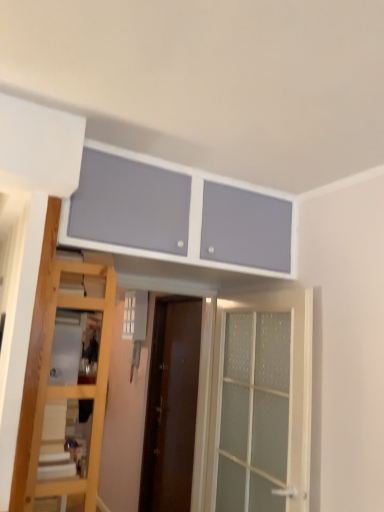
What do you see at coordinates (290, 386) in the screenshot?
I see `clear glass door at center, arranged as the first door when viewed from the front` at bounding box center [290, 386].

Where is `brown wooden door at center, placed as the first door when sorted from back to front`? This screenshot has height=512, width=384. brown wooden door at center, placed as the first door when sorted from back to front is located at coordinates (171, 407).

Does brown wooden door at center, the 2th door from the right, come in front of wooden ladder at lower left?

No, it is behind wooden ladder at lower left.

How different are the orientations of brown wooden door at center, the 2th door from the right, and wooden ladder at lower left in degrees?

The angular difference between brown wooden door at center, the 2th door from the right, and wooden ladder at lower left is 178 degrees.

Which object is wider, brown wooden door at center, acting as the first door starting from the left, or wooden ladder at lower left?

wooden ladder at lower left.

Which is more to the left, wooden ladder at lower left or matte white cabinet at upper center?

From the viewer's perspective, wooden ladder at lower left appears more on the left side.

Considering the positions of points (69, 472) and (207, 190), is point (69, 472) closer to camera compared to point (207, 190)?

Yes.

From the image's perspective, which object appears higher, wooden ladder at lower left or matte white cabinet at upper center?

matte white cabinet at upper center is shown above in the image.

Which object is closer to the camera taking this photo, wooden ladder at lower left or matte white cabinet at upper center?

Positioned in front is wooden ladder at lower left.

From the image's perspective, which object appears higher, brown wooden door at center, placed as the first door when sorted from back to front, or matte white cabinet at upper center?

matte white cabinet at upper center appears higher in the image.

Can we say brown wooden door at center, the 2th door from the right, lies outside matte white cabinet at upper center?

brown wooden door at center, the 2th door from the right, lies outside matte white cabinet at upper center's area.

Is brown wooden door at center, positioned as the second door in front-to-back order, aimed at matte white cabinet at upper center?

No, brown wooden door at center, positioned as the second door in front-to-back order, is not facing towards matte white cabinet at upper center.

At what (x,y) coordinates should I click in order to perform the action: click on door on the left of matte white cabinet at upper center. Please return your answer as a coordinate pair (x, y). Looking at the image, I should click on (171, 407).

Which is behind, point (51, 431) or point (189, 470)?

The point (189, 470) is farther.

Can you tell me how much wooden ladder at lower left and brown wooden door at center, placed as the first door when sorted from back to front, differ in facing direction?

They differ by 178 degrees in their facing directions.

Can we say wooden ladder at lower left lies outside brown wooden door at center, acting as the first door starting from the left?

Yes, wooden ladder at lower left is not within brown wooden door at center, acting as the first door starting from the left.

Is wooden ladder at lower left not near brown wooden door at center, acting as the first door starting from the left?

Yes, wooden ladder at lower left and brown wooden door at center, acting as the first door starting from the left, are located far from each other.

Between matte white cabinet at upper center and wooden ladder at lower left, which one has larger size?

With larger size is matte white cabinet at upper center.

Which point is more distant from viewer, (118,200) or (43,444)?

The point (118,200) is farther.

How far apart are matte white cabinet at upper center and wooden ladder at lower left?

matte white cabinet at upper center is 34.66 inches from wooden ladder at lower left.

Considering the relative positions of matte white cabinet at upper center and wooden ladder at lower left in the image provided, is matte white cabinet at upper center to the right of wooden ladder at lower left from the viewer's perspective?

Indeed, matte white cabinet at upper center is positioned on the right side of wooden ladder at lower left.

In the scene shown: Between clear glass door at center, the second door positioned from the back, and wooden ladder at lower left, which one has less height?

Standing shorter between the two is wooden ladder at lower left.

Is clear glass door at center, the second door positioned from the back, bigger than wooden ladder at lower left?

Correct, clear glass door at center, the second door positioned from the back, is larger in size than wooden ladder at lower left.

From the image's perspective, which one is positioned higher, clear glass door at center, the 1th door viewed from the right, or wooden ladder at lower left?

wooden ladder at lower left appears higher in the image.

Can you tell me how much clear glass door at center, arranged as the first door when viewed from the front, and wooden ladder at lower left differ in facing direction?

179 degrees.

Is wooden ladder at lower left in front of or behind clear glass door at center, the second door positioned from the back, in the image?

wooden ladder at lower left is in front of clear glass door at center, the second door positioned from the back.

From the image's perspective, is wooden ladder at lower left over clear glass door at center, the 1th door viewed from the right?

Yes, from the image's perspective, wooden ladder at lower left is above clear glass door at center, the 1th door viewed from the right.

Considering the sizes of objects wooden ladder at lower left and clear glass door at center, arranged as the first door when viewed from the front, in the image provided, who is taller, wooden ladder at lower left or clear glass door at center, arranged as the first door when viewed from the front,?

clear glass door at center, arranged as the first door when viewed from the front, is taller.

Is clear glass door at center, which is counted as the 2th door, starting from the left, inside wooden ladder at lower left?

No, clear glass door at center, which is counted as the 2th door, starting from the left, is not a part of wooden ladder at lower left.

The height and width of the screenshot is (512, 384). What are the coordinates of `shelf lying in front of the brown wooden door at center, positioned as the second door in front-to-back order` in the screenshot? It's located at (58, 442).

Locate an element on the screen. Image resolution: width=384 pixels, height=512 pixels. cabinetry located behind the wooden ladder at lower left is located at coordinates (175, 215).

Estimate the real-world distances between objects in this image. Which object is closer to matte white cabinet at upper center, wooden ladder at lower left or clear glass door at center, which is counted as the 2th door, starting from the left?

clear glass door at center, which is counted as the 2th door, starting from the left, is positioned closer to the anchor matte white cabinet at upper center.

Estimate the real-world distances between objects in this image. Which object is closer to wooden ladder at lower left, brown wooden door at center, positioned as the second door in front-to-back order, or matte white cabinet at upper center?

Based on the image, matte white cabinet at upper center appears to be nearer to wooden ladder at lower left.

From the image, which object appears to be farther from wooden ladder at lower left, brown wooden door at center, positioned as the second door in front-to-back order, or clear glass door at center, which is counted as the 2th door, starting from the left?

brown wooden door at center, positioned as the second door in front-to-back order, is positioned further to the anchor wooden ladder at lower left.

From the image, which object appears to be farther from brown wooden door at center, acting as the first door starting from the left, clear glass door at center, which is counted as the 2th door, starting from the left, or wooden ladder at lower left?

wooden ladder at lower left.

From the image, which object appears to be nearer to clear glass door at center, arranged as the first door when viewed from the front, wooden ladder at lower left or matte white cabinet at upper center?

Based on the image, matte white cabinet at upper center appears to be nearer to clear glass door at center, arranged as the first door when viewed from the front.

Estimate the real-world distances between objects in this image. Which object is closer to clear glass door at center, arranged as the first door when viewed from the front, brown wooden door at center, acting as the first door starting from the left, or wooden ladder at lower left?

Based on the image, brown wooden door at center, acting as the first door starting from the left, appears to be nearer to clear glass door at center, arranged as the first door when viewed from the front.

Looking at the image, which one is located closer to wooden ladder at lower left, clear glass door at center, the 1th door viewed from the right, or brown wooden door at center, the 2th door from the right?

Among the two, clear glass door at center, the 1th door viewed from the right, is located nearer to wooden ladder at lower left.

Considering their positions, is matte white cabinet at upper center positioned closer to brown wooden door at center, placed as the first door when sorted from back to front, than clear glass door at center, the 1th door viewed from the right?

Based on the image, clear glass door at center, the 1th door viewed from the right, appears to be nearer to brown wooden door at center, placed as the first door when sorted from back to front.

This screenshot has height=512, width=384. In order to click on cabinetry between wooden ladder at lower left and brown wooden door at center, positioned as the second door in front-to-back order, from front to back in this screenshot , I will do `click(175, 215)`.

Locate an element on the screen. This screenshot has height=512, width=384. door between wooden ladder at lower left and brown wooden door at center, acting as the first door starting from the left, along the z-axis is located at coordinates (290, 386).

This screenshot has width=384, height=512. I want to click on shelf that lies between matte white cabinet at upper center and clear glass door at center, the 1th door viewed from the right, from top to bottom, so click(58, 442).

Locate an element on the screen. This screenshot has width=384, height=512. door that lies between matte white cabinet at upper center and brown wooden door at center, positioned as the second door in front-to-back order, from top to bottom is located at coordinates (290, 386).